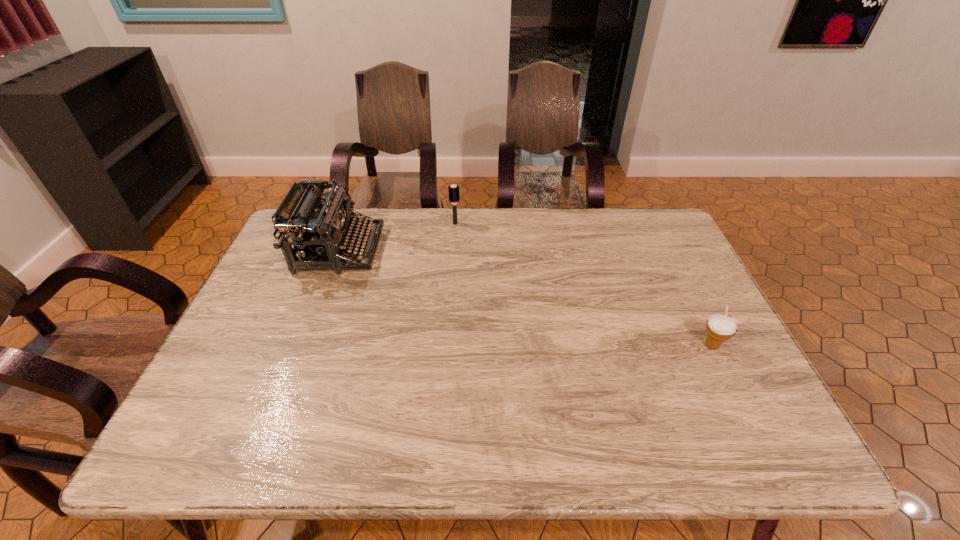
Image resolution: width=960 pixels, height=540 pixels. In the image, there is a desktop. What are the coordinates of `vacant space at the near right corner` in the screenshot? It's located at (734, 421).

Identify the location of vacant area that lies between the shortest object and the second object from left to right. This screenshot has width=960, height=540. (584, 285).

The image size is (960, 540). Identify the location of empty space between the typewriter and the rightmost object. (525, 298).

Where is `vacant space that's between the tallest object and the icecream`? Image resolution: width=960 pixels, height=540 pixels. vacant space that's between the tallest object and the icecream is located at coordinates (525, 298).

Find the location of `free spot between the nearest object and the tallest object`. free spot between the nearest object and the tallest object is located at coordinates (525, 298).

In order to click on empty location between the shortest object and the hairbrush in this screenshot , I will do `click(584, 285)`.

Find the location of `free space between the hairbrush and the leftmost object`. free space between the hairbrush and the leftmost object is located at coordinates (397, 237).

Locate an element on the screen. empty space between the shortest object and the second object from right to left is located at coordinates (584, 285).

This screenshot has width=960, height=540. Identify the location of blank region between the typewriter and the hairbrush. (397, 237).

At what (x,y) coordinates should I click in order to perform the action: click on vacant point located between the tallest object and the icecream. Please return your answer as a coordinate pair (x, y). The width and height of the screenshot is (960, 540). Looking at the image, I should click on (525, 298).